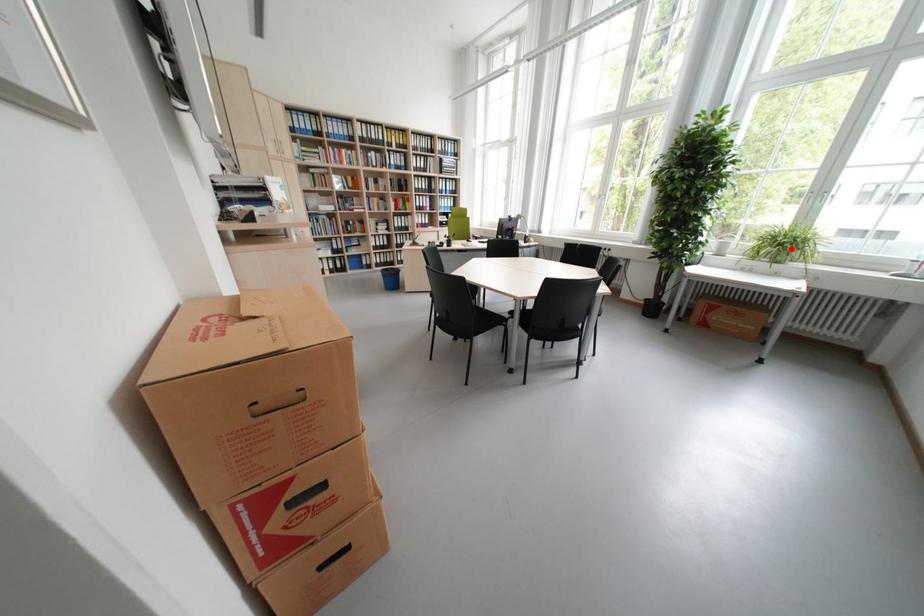
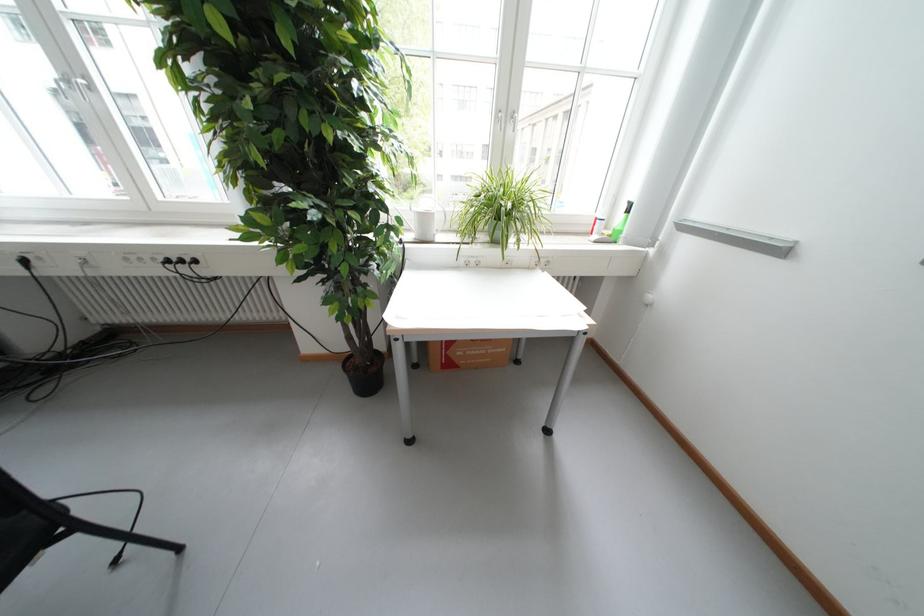
Question: I am providing you with two images of the same scene from different viewpoints. In image1, a red point is highlighted. Considering the same 3D point in image2, which of the following is correct?

Choices:
 (A) It is closer
 (B) It is farther

Answer: (A)